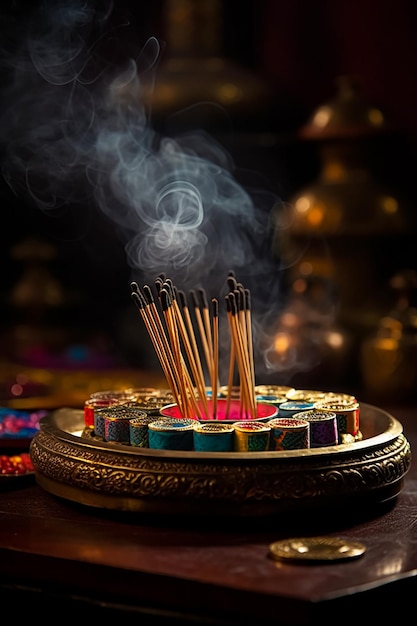
Find the location of `gold coin on the table`. gold coin on the table is located at coordinates (322, 546).